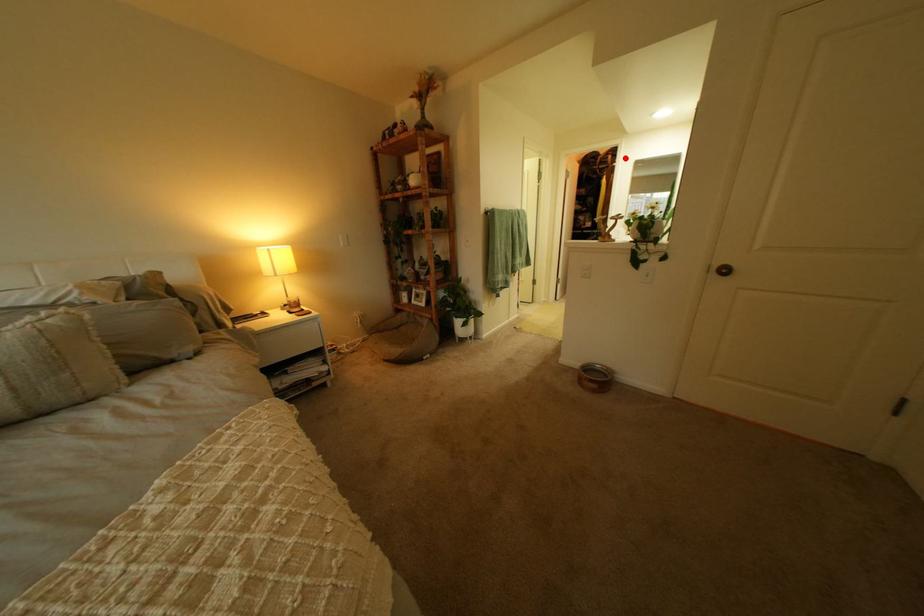
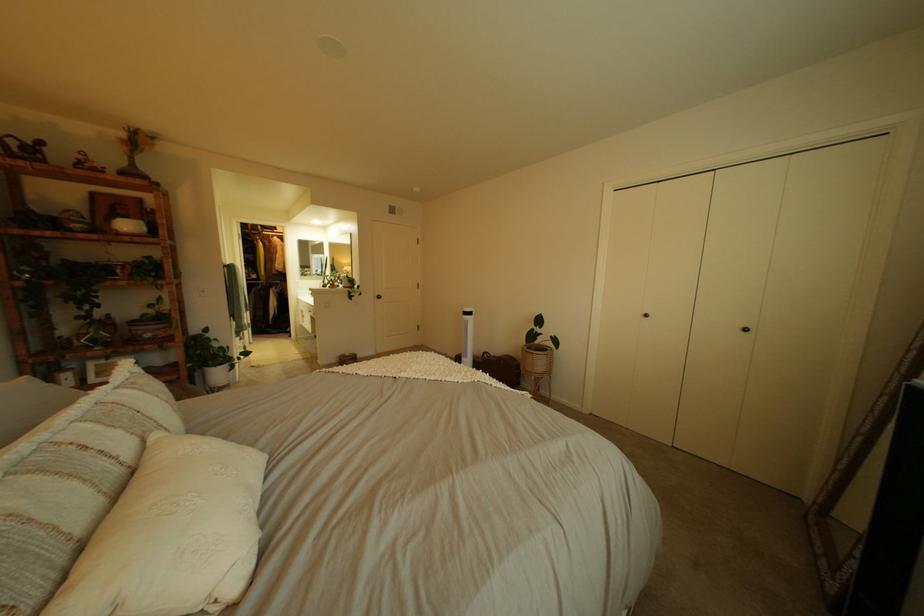
In the second image, find the point that corresponds to the highlighted location in the first image.

(274, 228)